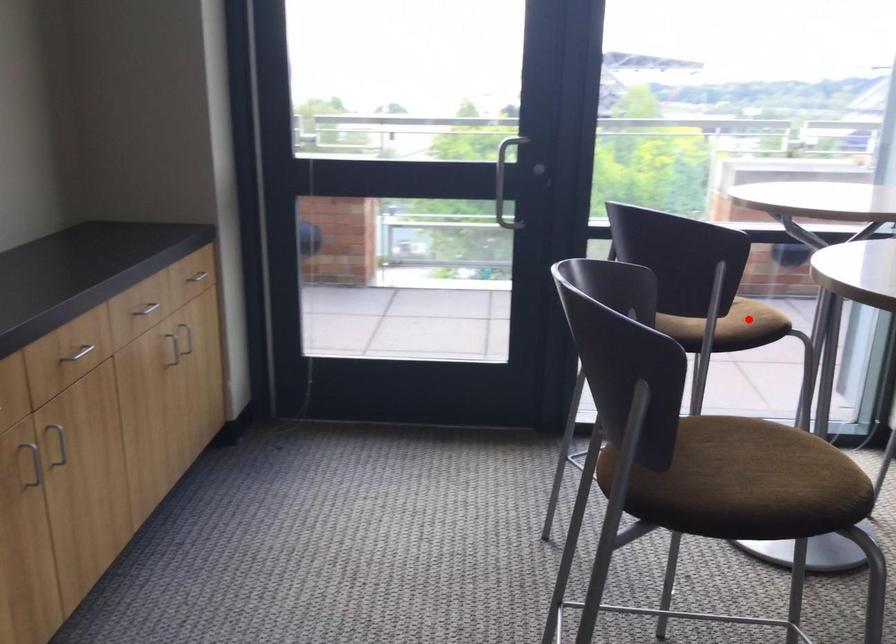
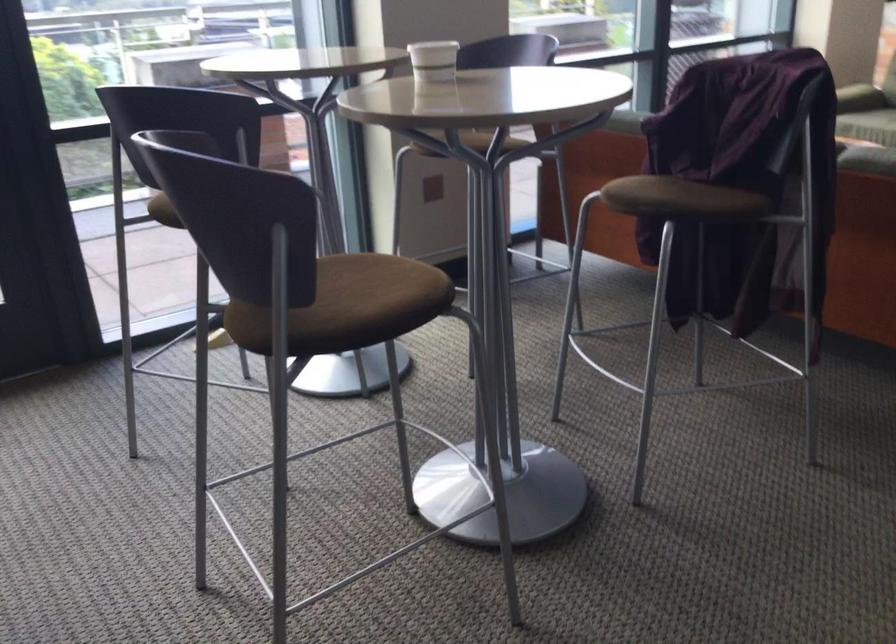
Question: I am providing you with two images of the same scene from different viewpoints. A red point is marked on the first image. At the location where the point appears in image 1, is it still visible in image 2?

Choices:
 (A) Yes
 (B) No

Answer: (B)